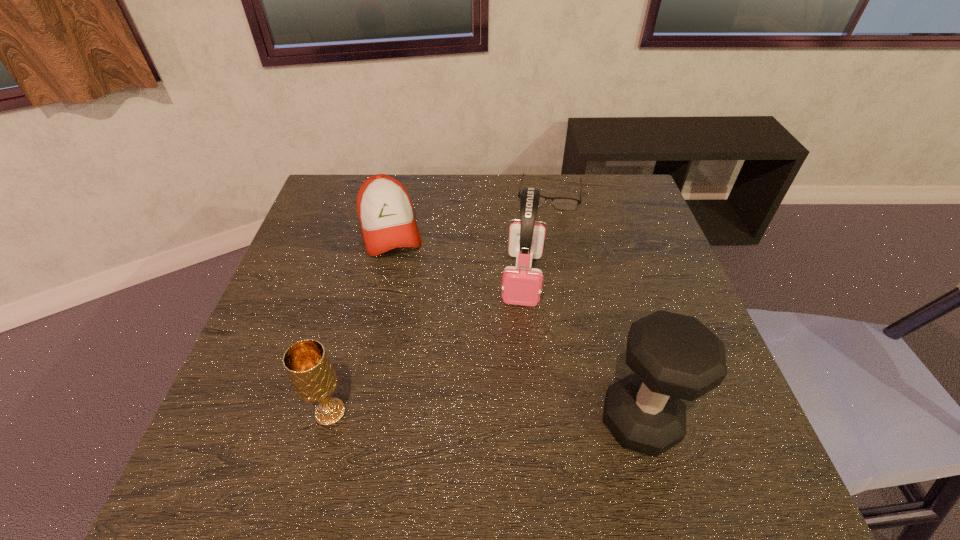
At what (x,y) coordinates should I click in order to perform the action: click on free spot on the desktop that is between the third tallest object and the dumbbell and is positioned on the outer surface of the earphone. Please return your answer as a coordinate pair (x, y). This screenshot has width=960, height=540. Looking at the image, I should click on (509, 417).

In order to click on vacant space on the desktop that is between the chalice and the dumbbell and is positioned on the front-facing side of the fourth tallest object in this screenshot , I will do `click(444, 415)`.

Locate an element on the screen. vacant spot on the desktop that is between the third shortest object and the dumbbell and is positioned on the front-facing side of the spectacles is located at coordinates (522, 417).